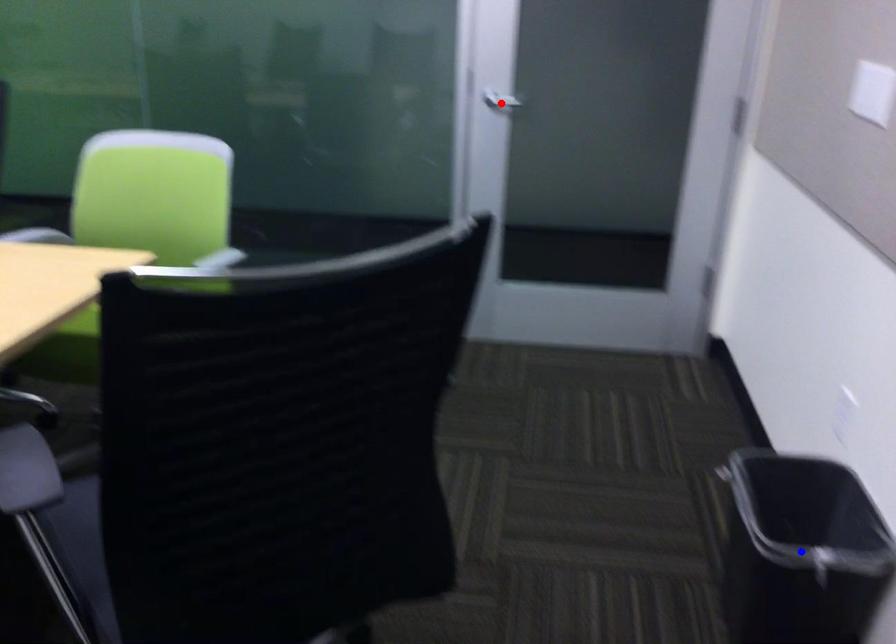
Question: Two points are marked on the image. Which point is closer to the camera?

Choices:
 (A) Blue point is closer.
 (B) Red point is closer.

Answer: (A)